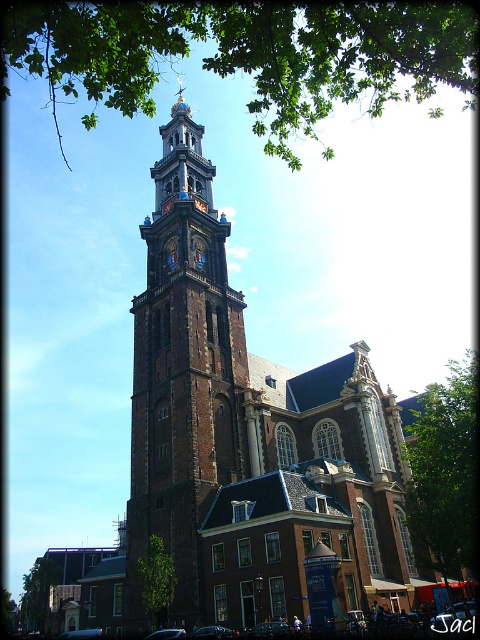
You are a landscape architect planning to add more trees to the area around the church tower. You notice the green leafy tree at right and the green leafy tree at lower left in the image. Which tree has a larger width according to the scene description?

The green leafy tree at right might be wider than green leafy tree at lower left according to the scene description.

You are a tourist standing in front of the brown stone church at center and the green leafy tree at lower left. Which object is taller?

The brown stone church at center is taller than the green leafy tree at lower left according to the description.

You are standing in front of the church tower and want to take a photo of the green leafy tree at right. Where should you position yourself to capture the tree in your shot?

The green leafy tree at right is located at point (444, 472), so you should position yourself to the right side of the scene to capture it in your photo.